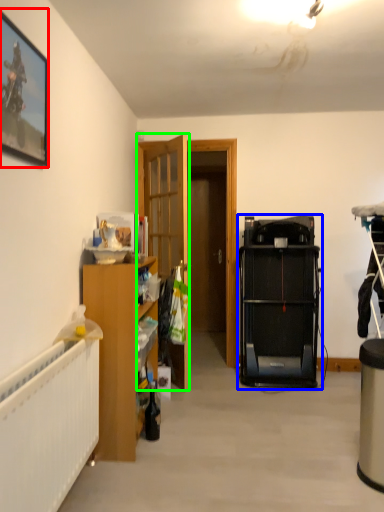
Question: Based on their relative distances, which object is farther from picture frame (highlighted by a red box)? Choose from equipment (highlighted by a blue box) and door (highlighted by a green box).

Choices:
 (A) equipment
 (B) door

Answer: (A)